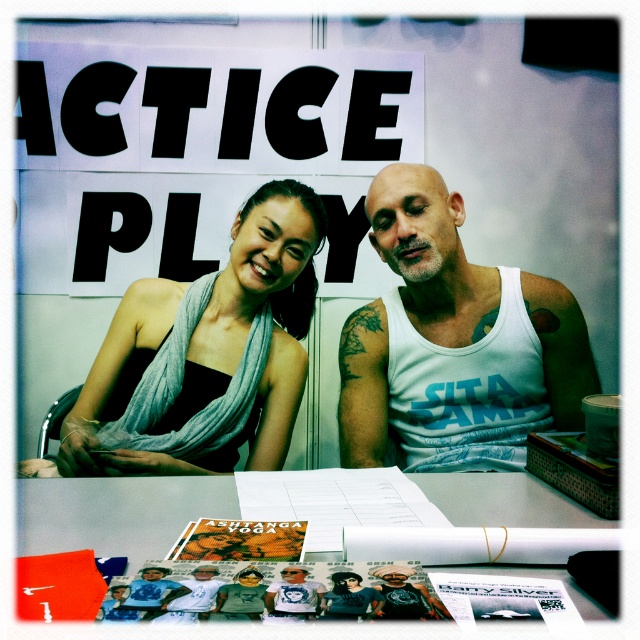
Which is in front, point (115, 340) or point (470, 483)?

Point (470, 483) is in front.

Can you confirm if matte black dress at center is positioned below white paper at center?

Actually, matte black dress at center is above white paper at center.

Between point (132, 321) and point (442, 488), which one is positioned behind?

Positioned behind is point (132, 321).

This screenshot has width=640, height=640. Find the location of `matte black dress at center`. matte black dress at center is located at coordinates click(208, 355).

Is matte white tank top at center shorter than matte black dress at center?

Indeed, matte white tank top at center has a lesser height compared to matte black dress at center.

Which of these two, matte white tank top at center or matte black dress at center, stands taller?

Standing taller between the two is matte black dress at center.

The height and width of the screenshot is (640, 640). I want to click on matte white tank top at center, so click(x=452, y=342).

Between matte white tank top at center and white paper at center, which one appears on the right side from the viewer's perspective?

matte white tank top at center is more to the right.

Is point (401, 188) positioned after point (508, 502)?

Yes, it is behind point (508, 502).

Where is `matte white tank top at center`? The width and height of the screenshot is (640, 640). matte white tank top at center is located at coordinates (452, 342).